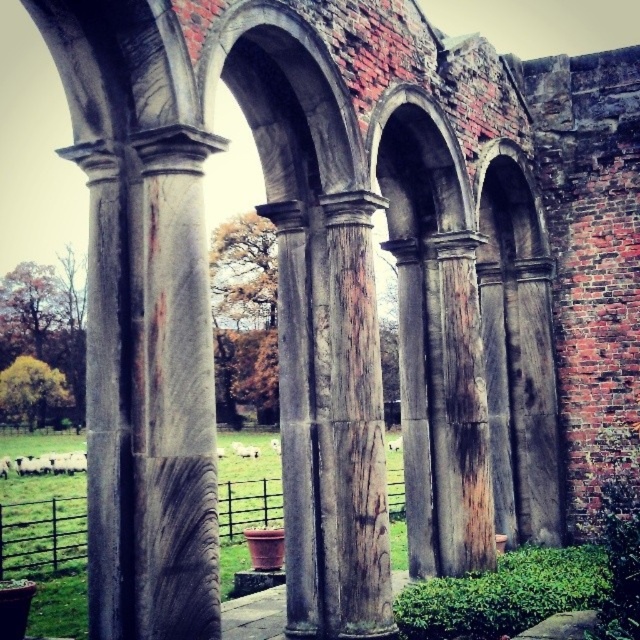
Question: Considering the relative positions of marble column at center and rusty metal archway at center in the image provided, where is marble column at center located with respect to rusty metal archway at center?

Choices:
 (A) above
 (B) below

Answer: (B)

Question: Which of the following is the closest to the observer?

Choices:
 (A) (189, 582)
 (B) (444, 124)

Answer: (A)

Question: Is marble column at center above rusty metal archway at center?

Choices:
 (A) yes
 (B) no

Answer: (B)

Question: Does marble column at center have a larger size compared to rusty metal archway at center?

Choices:
 (A) no
 (B) yes

Answer: (A)